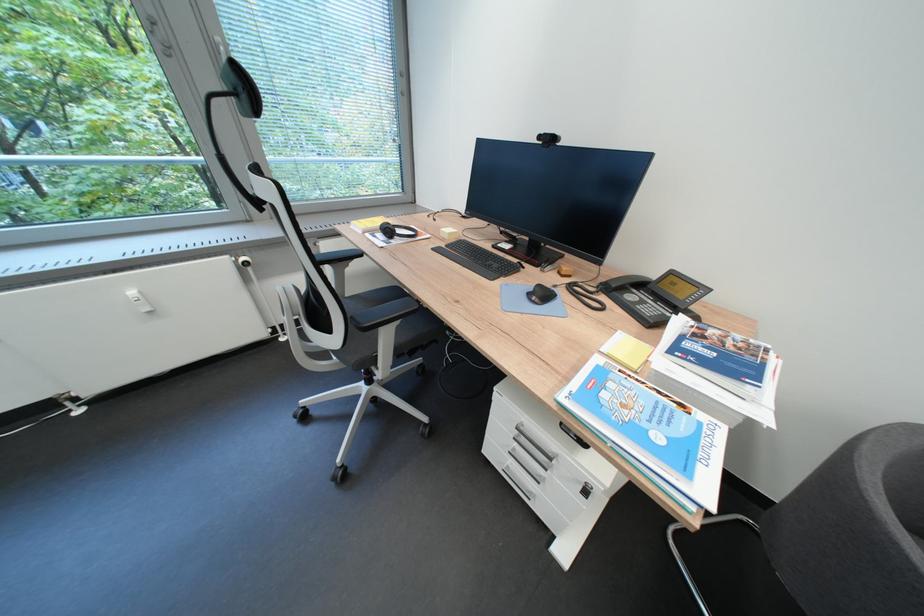
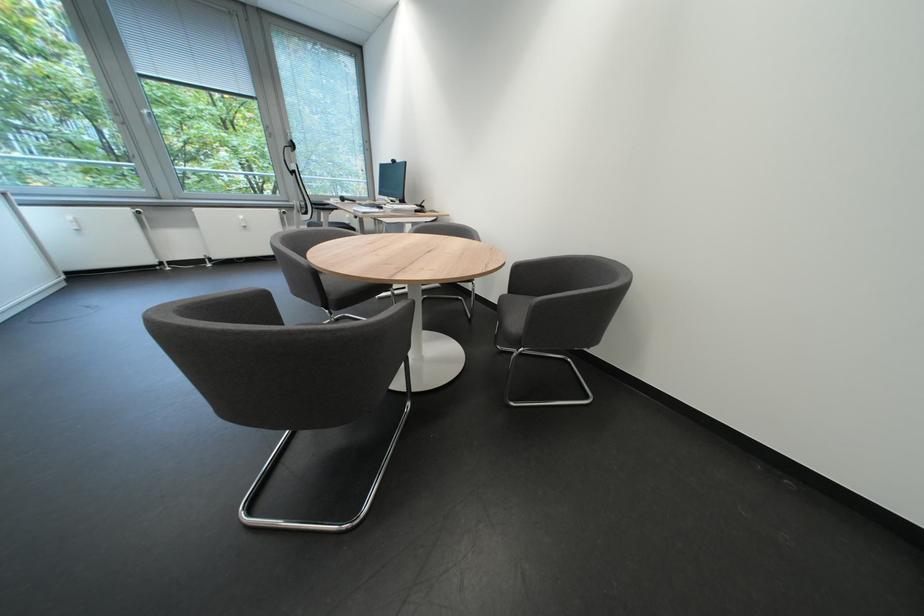
Which direction would the cameraman need to move to produce the second image?

The movement direction of the cameraman is right, backward.